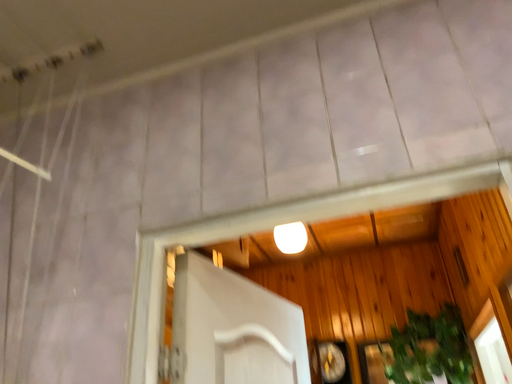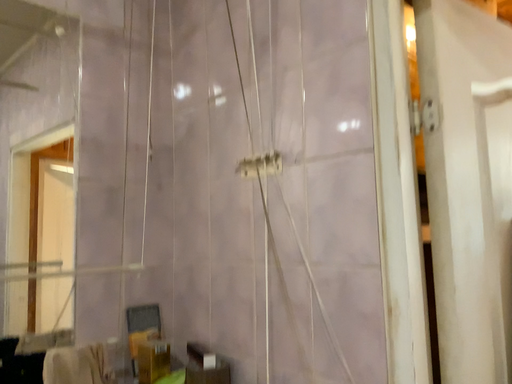
Question: Which way did the camera rotate in the video?

Choices:
 (A) rotated upward
 (B) rotated downward

Answer: (B)